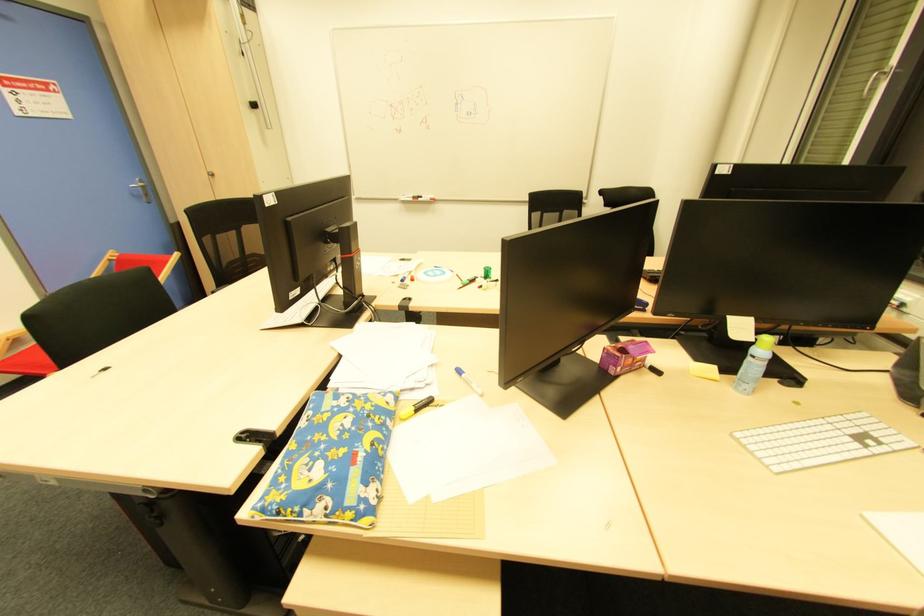
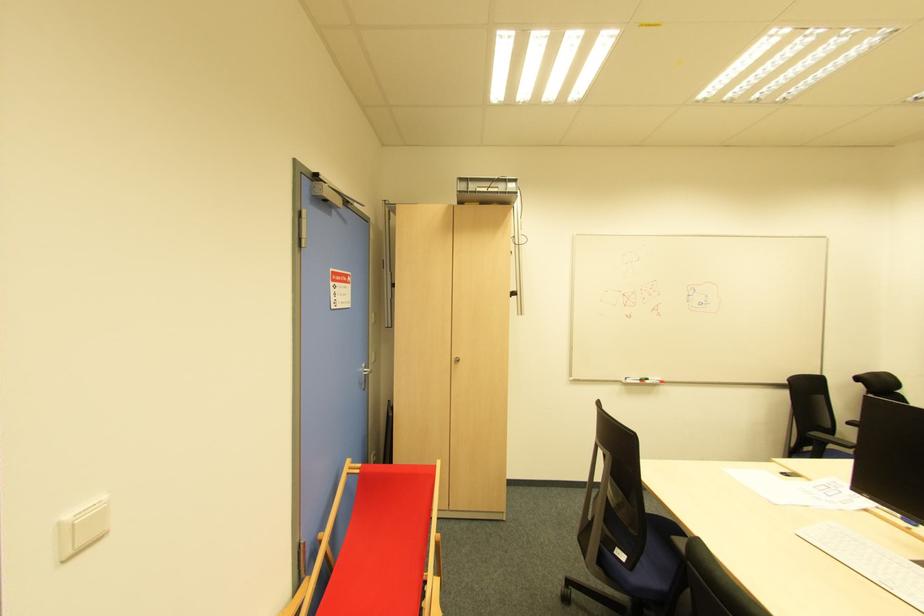
Find the pixel in the second image that matches (x=213, y=177) in the first image.

(457, 362)